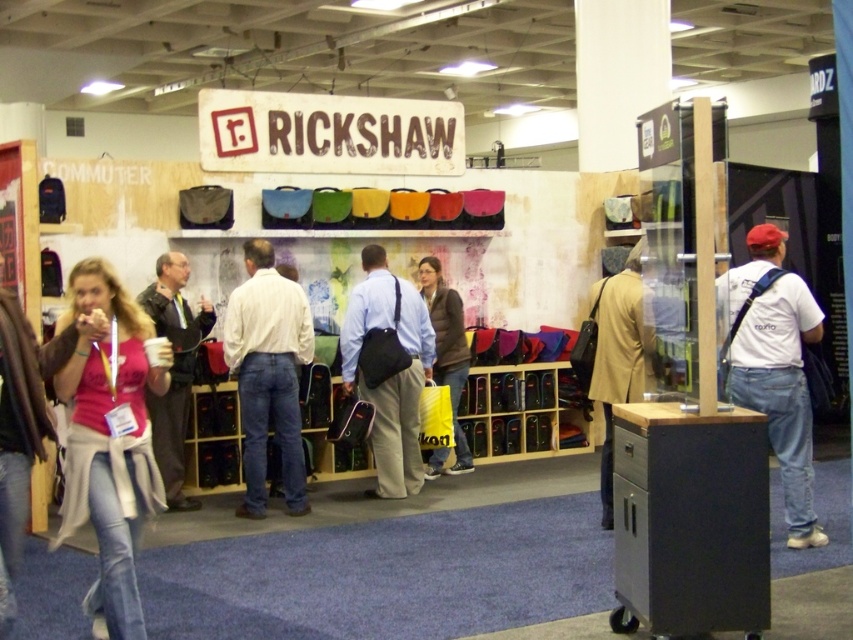
Between white cotton t-shirt at right and light brown leather jacket at center, which one has less height?

Standing shorter between the two is light brown leather jacket at center.

Between point (798, 456) and point (595, 396), which one is positioned in front?

Point (798, 456) is more forward.

Where is `white cotton t-shirt at right`? The height and width of the screenshot is (640, 853). white cotton t-shirt at right is located at coordinates (775, 369).

Does white cotton t-shirt at right appear under matte black jacket at left?

No, white cotton t-shirt at right is not below matte black jacket at left.

Where is `white cotton t-shirt at right`? This screenshot has width=853, height=640. white cotton t-shirt at right is located at coordinates (775, 369).

Identify the location of white cotton t-shirt at right. (775, 369).

The height and width of the screenshot is (640, 853). I want to click on white cotton t-shirt at right, so click(x=775, y=369).

Between point (805, 460) and point (469, 355), which one is positioned behind?

The point (469, 355) is behind.

Is point (743, 388) positioned in front of point (463, 465)?

That is True.

The image size is (853, 640). In order to click on white cotton t-shirt at right in this screenshot , I will do `click(775, 369)`.